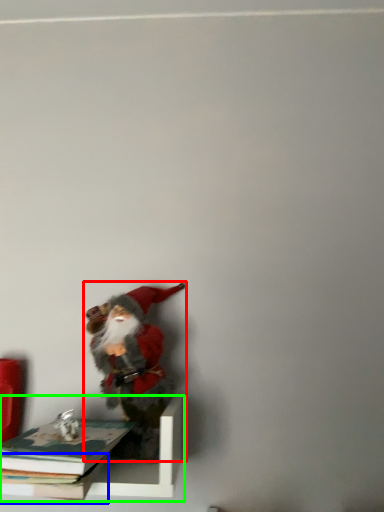
Question: Which object is the closest to the person (highlighted by a red box)? Choose among these: book (highlighted by a blue box) or shelf (highlighted by a green box).

Choices:
 (A) book
 (B) shelf

Answer: (B)